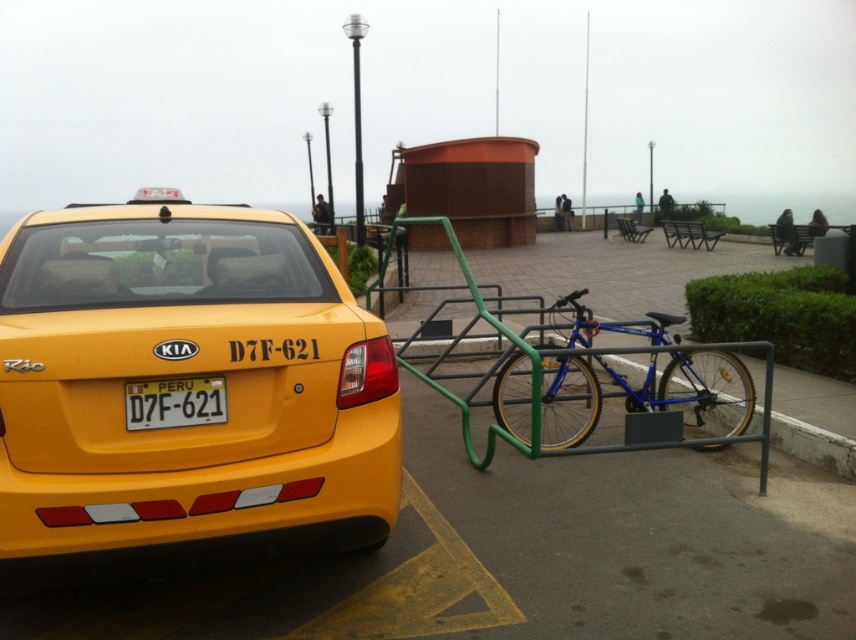
Question: Considering the relative positions of green metal bike rack at center and yellow plastic license plate at rear in the image provided, where is green metal bike rack at center located with respect to yellow plastic license plate at rear?

Choices:
 (A) right
 (B) left

Answer: (A)

Question: Does yellow matte taxi at upper left have a larger size compared to yellow plastic license plate at rear?

Choices:
 (A) yes
 (B) no

Answer: (A)

Question: Among these objects, which one is farthest from the camera?

Choices:
 (A) yellow matte taxi at upper left
 (B) green metal bike rack at center
 (C) blue metallic bicycle at center

Answer: (C)

Question: In this image, where is blue metallic bicycle at center located relative to yellow plastic license plate at rear?

Choices:
 (A) right
 (B) left

Answer: (A)

Question: Considering the real-world distances, which object is farthest from the blue metallic bicycle at center?

Choices:
 (A) green metal bike rack at center
 (B) yellow plastic license plate at rear

Answer: (B)

Question: Which of the following is the closest to the observer?

Choices:
 (A) yellow plastic license plate at rear
 (B) blue metallic bicycle at center
 (C) yellow matte taxi at upper left

Answer: (C)